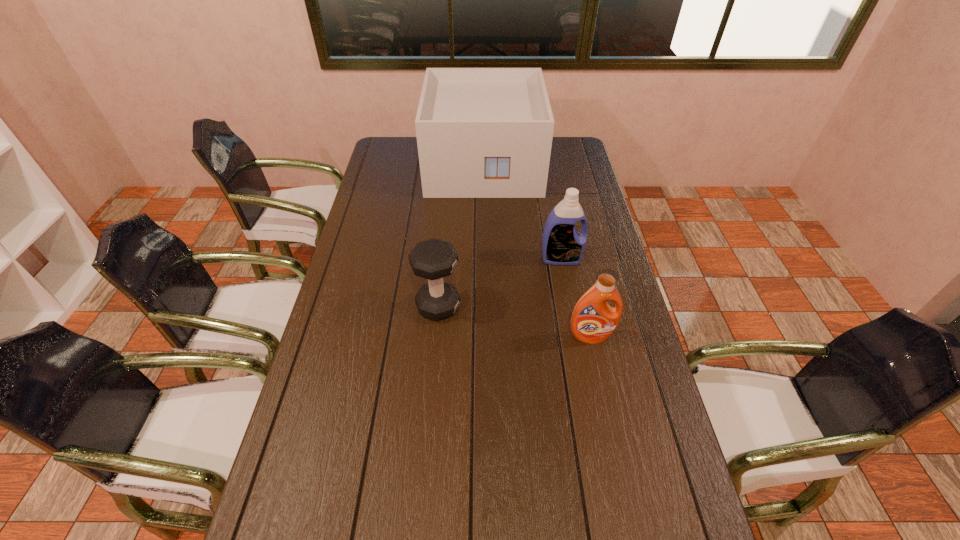
Identify the location of blank region between the dumbbell and the farther detergent. (499, 282).

Locate which object is the closest to the farthest object. Please provide its 2D coordinates. Your answer should be formatted as a tuple, i.e. [(x, y)], where the tuple contains the x and y coordinates of a point satisfying the conditions above.

[(562, 244)]

I want to click on object that is the second closest one to the nearer detergent, so click(433, 259).